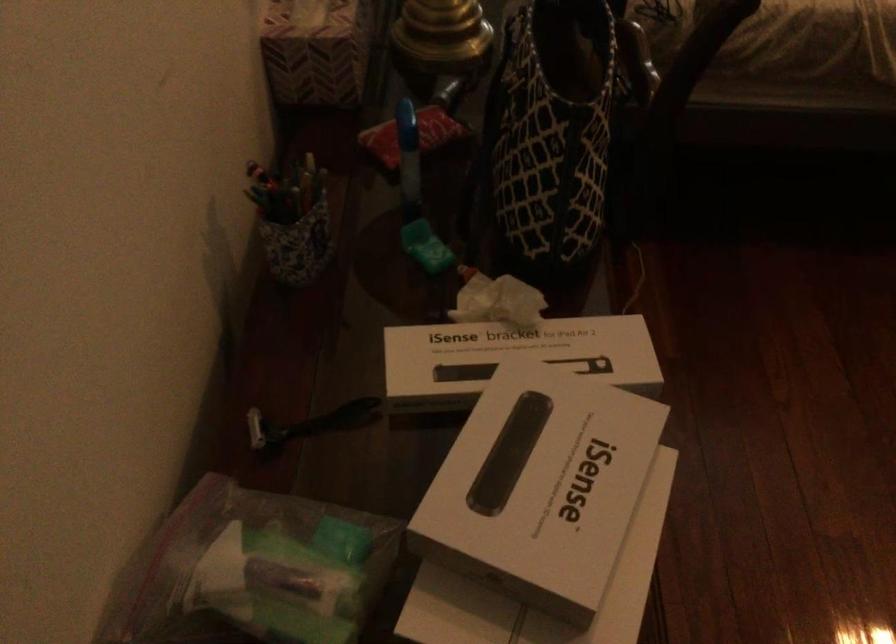
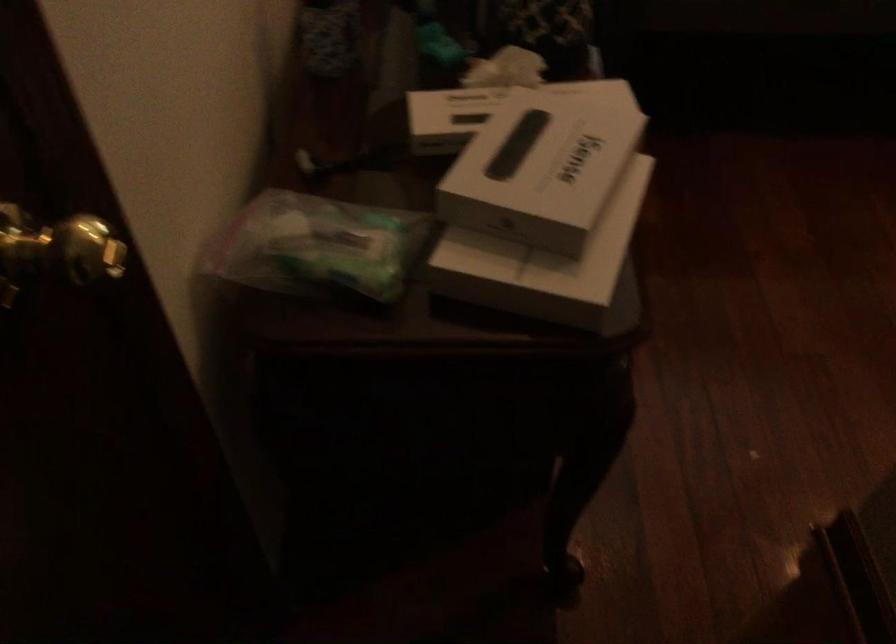
Question: In a continuous first-person perspective shot, in which direction is the camera moving?

Choices:
 (A) Left
 (B) Right
 (C) Forward
 (D) Backward

Answer: (D)